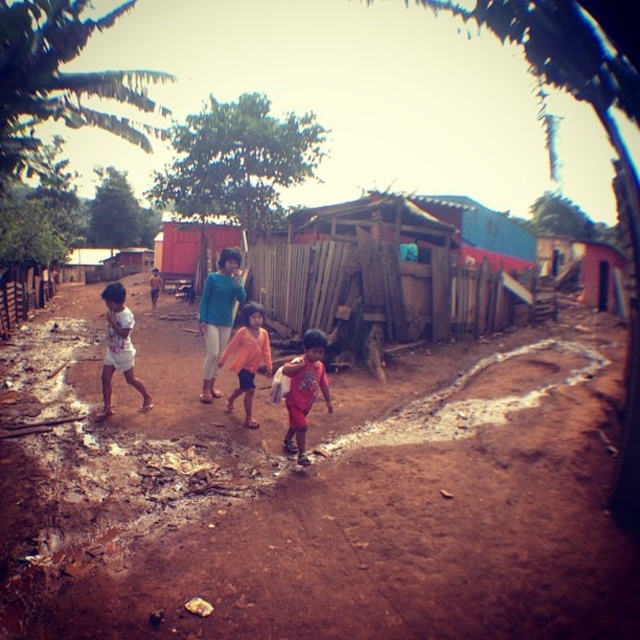
Question: Which point is closer to the camera?

Choices:
 (A) (250, 376)
 (B) (566, 394)
 (C) (323, 387)
 (D) (124, 314)

Answer: (C)

Question: Does red matte shirt at center appear on the right side of orange cotton shirt at center?

Choices:
 (A) yes
 (B) no

Answer: (A)

Question: Does brown dirt field at center appear on the right side of red matte shirt at center?

Choices:
 (A) yes
 (B) no

Answer: (B)

Question: Based on their relative distances, which object is nearer to the red matte shirt at center?

Choices:
 (A) orange cotton shirt at center
 (B) brown dirt field at center

Answer: (A)

Question: Can you confirm if brown dirt field at center is bigger than white cotton shirt at left?

Choices:
 (A) no
 (B) yes

Answer: (B)

Question: Which point is farther to the camera?

Choices:
 (A) (541, 573)
 (B) (138, 387)
 (C) (240, 333)

Answer: (B)